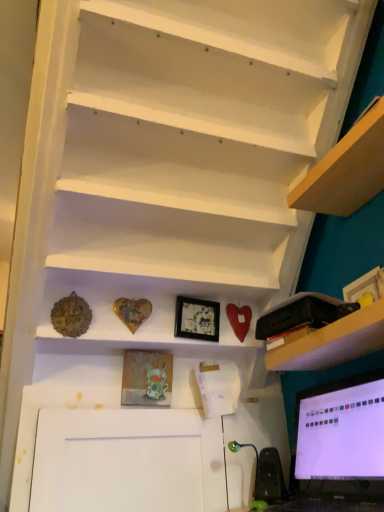
What is the approximate width of matte black monitor at lower right?

The width of matte black monitor at lower right is 6.34 inches.

What is the approximate height of black plastic bag at upper right?

The height of black plastic bag at upper right is 2.66 inches.

What are the coordinates of `black glossy picture frame at center, which is counted as the second picture frame, starting from the left` in the screenshot? It's located at (197, 319).

The width and height of the screenshot is (384, 512). What do you see at coordinates (146, 378) in the screenshot? I see `wooden textured picture frame at center, the 1th picture frame positioned from the bottom` at bounding box center [146, 378].

Image resolution: width=384 pixels, height=512 pixels. In order to click on wooden textured picture frame at center, which appears as the second picture frame when viewed from the right in this screenshot , I will do `click(146, 378)`.

Where is `matte black monitor at lower right`? The image size is (384, 512). matte black monitor at lower right is located at coordinates (340, 437).

From the picture: Based on their positions, is matte black monitor at lower right located to the left or right of white matte stairs at upper center?

Based on their positions, matte black monitor at lower right is located to the right of white matte stairs at upper center.

Identify the location of computer monitor in front of the white matte stairs at upper center. Image resolution: width=384 pixels, height=512 pixels. (340, 437).

Who is smaller, matte black monitor at lower right or white matte stairs at upper center?

matte black monitor at lower right.

Looking at this image, can you tell me how much matte black monitor at lower right and white matte stairs at upper center differ in facing direction?

90.6 degrees.

Can you confirm if black plastic bag at upper right is smaller than matte black monitor at lower right?

Yes.

Can you confirm if black plastic bag at upper right is positioned to the left of matte black monitor at lower right?

Correct, you'll find black plastic bag at upper right to the left of matte black monitor at lower right.

Between black plastic bag at upper right and matte black monitor at lower right, which one has more height?

matte black monitor at lower right.

From the image's perspective, which object appears higher, black plastic bag at upper right or white matte stairs at upper center?

From the image's view, white matte stairs at upper center is above.

How far apart are black plastic bag at upper right and white matte stairs at upper center?

black plastic bag at upper right is 27.35 inches from white matte stairs at upper center.

Considering the sizes of black plastic bag at upper right and white matte stairs at upper center in the image, is black plastic bag at upper right wider or thinner than white matte stairs at upper center?

black plastic bag at upper right is wider than white matte stairs at upper center.

Who is smaller, black plastic bag at upper right or white matte stairs at upper center?

black plastic bag at upper right is smaller.

From the picture: Which object is further away from the camera taking this photo, black plastic bag at upper right or black glossy picture frame at center, marked as the first picture frame in a top-to-bottom arrangement?

black glossy picture frame at center, marked as the first picture frame in a top-to-bottom arrangement, is further from the camera.

Between black plastic bag at upper right and black glossy picture frame at center, acting as the 2th picture frame starting from the bottom, which one appears on the right side from the viewer's perspective?

From the viewer's perspective, black plastic bag at upper right appears more on the right side.

What's the angular difference between black plastic bag at upper right and black glossy picture frame at center, acting as the 2th picture frame starting from the bottom,'s facing directions?

The angle between the facing direction of black plastic bag at upper right and the facing direction of black glossy picture frame at center, acting as the 2th picture frame starting from the bottom, is 95.5 degrees.

Does point (337, 449) appear closer or farther from the camera than point (198, 330)?

Point (337, 449) is positioned farther from the camera compared to point (198, 330).

Are matte black monitor at lower right and black glossy picture frame at center, which is counted as the second picture frame, starting from the left, located far from each other?

No, matte black monitor at lower right is in close proximity to black glossy picture frame at center, which is counted as the second picture frame, starting from the left.

In the image, there is a black glossy picture frame at center, which is counted as the second picture frame, starting from the left. Identify the location of computer monitor below it (from the image's perspective). This screenshot has height=512, width=384. (340, 437).

Is matte black monitor at lower right facing towards black glossy picture frame at center, which is counted as the second picture frame, starting from the left?

No, matte black monitor at lower right is not facing towards black glossy picture frame at center, which is counted as the second picture frame, starting from the left.

Is matte black monitor at lower right at the back of wooden textured picture frame at center, which appears as the second picture frame when viewed from the right?

No, wooden textured picture frame at center, which appears as the second picture frame when viewed from the right,'s orientation is not away from matte black monitor at lower right.

From the image's perspective, would you say wooden textured picture frame at center, the 1th picture frame positioned from the bottom, is shown under matte black monitor at lower right?

No, from the image's perspective, wooden textured picture frame at center, the 1th picture frame positioned from the bottom, is not below matte black monitor at lower right.

Are wooden textured picture frame at center, the 2th picture frame from the top, and matte black monitor at lower right making contact?

No, wooden textured picture frame at center, the 2th picture frame from the top, is not touching matte black monitor at lower right.

Considering the positions of points (155, 388) and (308, 428), is point (155, 388) farther from camera compared to point (308, 428)?

No.

Is black glossy picture frame at center, which is counted as the second picture frame, starting from the left, taller than wooden heart at center?

No, black glossy picture frame at center, which is counted as the second picture frame, starting from the left, is not taller than wooden heart at center.

Which of these two, black glossy picture frame at center, acting as the 2th picture frame starting from the bottom, or wooden heart at center, is wider?

wooden heart at center.

Locate an element on the screen. The height and width of the screenshot is (512, 384). computer monitor in front of the white matte stairs at upper center is located at coordinates (340, 437).

The height and width of the screenshot is (512, 384). I want to click on computer monitor that appears below the black plastic bag at upper right (from a real-world perspective), so click(x=340, y=437).

When comparing their distances from matte black monitor at lower right, does wooden textured picture frame at center, the 2th picture frame from the top, or green rubber speaker at lower right seem further?

Based on the image, wooden textured picture frame at center, the 2th picture frame from the top, appears to be further to matte black monitor at lower right.

From the image, which object appears to be nearer to green rubber speaker at lower right, matte black monitor at lower right or white matte stairs at upper center?

matte black monitor at lower right is positioned closer to the anchor green rubber speaker at lower right.

Estimate the real-world distances between objects in this image. Which object is further from black glossy picture frame at center, marked as the first picture frame in a top-to-bottom arrangement, green rubber speaker at lower right or white matte stairs at upper center?

Based on the image, white matte stairs at upper center appears to be further to black glossy picture frame at center, marked as the first picture frame in a top-to-bottom arrangement.

Based on their spatial positions, is green rubber speaker at lower right or black glossy picture frame at center, acting as the 2th picture frame starting from the bottom, further from black plastic bag at upper right?

green rubber speaker at lower right is positioned further to the anchor black plastic bag at upper right.

Estimate the real-world distances between objects in this image. Which object is closer to green rubber speaker at lower right, matte black monitor at lower right or black plastic bag at upper right?

Result: Among the two, matte black monitor at lower right is located nearer to green rubber speaker at lower right.

From the image, which object appears to be farther from black glossy picture frame at center, which is counted as the second picture frame, starting from the left, black plastic bag at upper right or wooden textured picture frame at center, the 2th picture frame from the top?

black plastic bag at upper right.

Which object lies nearer to the anchor point white matte stairs at upper center, green rubber speaker at lower right or black glossy picture frame at center, arranged as the 1th picture frame when viewed from the right?

Among the two, black glossy picture frame at center, arranged as the 1th picture frame when viewed from the right, is located nearer to white matte stairs at upper center.

Which object lies further to the anchor point green rubber speaker at lower right, black glossy picture frame at center, acting as the 2th picture frame starting from the bottom, or white matte stairs at upper center?

The object further to green rubber speaker at lower right is white matte stairs at upper center.

Where is `shelf between wooden textured picture frame at center, the first picture frame viewed from the left, and matte black monitor at lower right`? The image size is (384, 512). shelf between wooden textured picture frame at center, the first picture frame viewed from the left, and matte black monitor at lower right is located at coordinates (333, 342).

Where is `cabinet that lies between white matte stairs at upper center and green rubber speaker at lower right from top to bottom`? Image resolution: width=384 pixels, height=512 pixels. cabinet that lies between white matte stairs at upper center and green rubber speaker at lower right from top to bottom is located at coordinates (152, 311).

Find the location of a particular element. Image resolution: width=384 pixels, height=512 pixels. cabinet between wooden textured picture frame at center, the 2th picture frame from the top, and black plastic bag at upper right, in the horizontal direction is located at coordinates (152, 311).

At what (x,y) coordinates should I click in order to perform the action: click on cabinet between white matte stairs at upper center and wooden textured picture frame at center, the 1th picture frame positioned from the bottom, vertically. Please return your answer as a coordinate pair (x, y). Looking at the image, I should click on (152, 311).